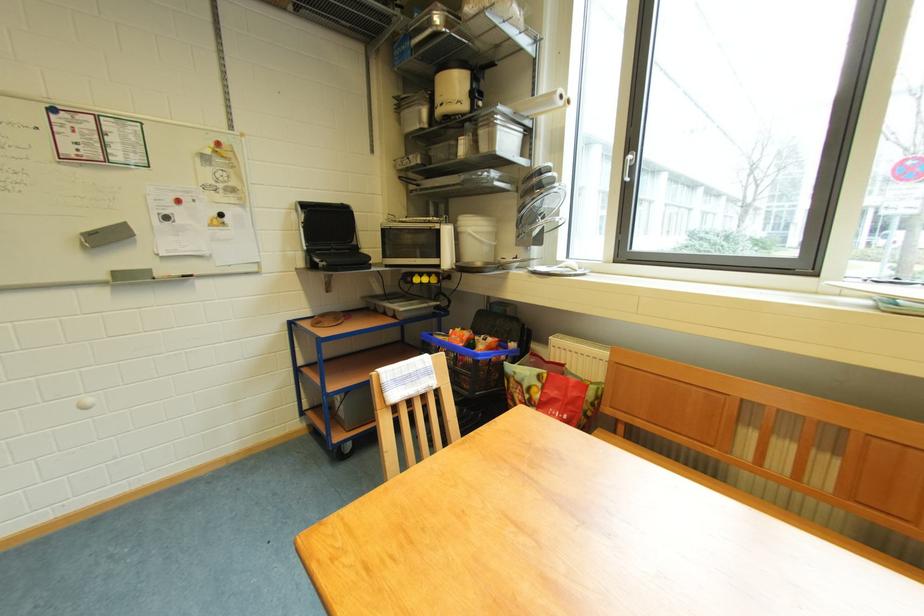
Find where to lift the black grill handle. Please return your answer as a coordinate pair (x, y).

(304, 229)